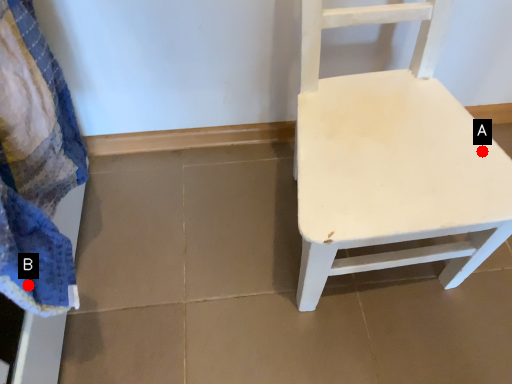
Question: Two points are circled on the image, labeled by A and B beside each circle. Among these points, which one is farthest from the camera?

Choices:
 (A) A is further
 (B) B is further

Answer: (A)